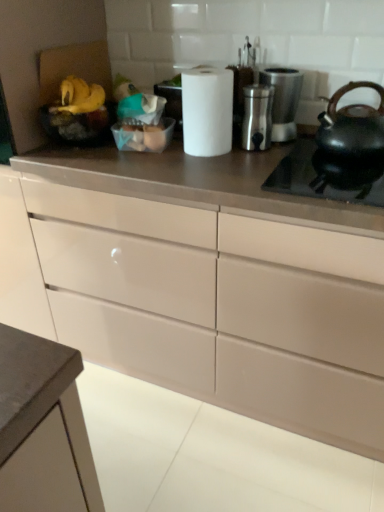
Find the location of a particular element. vacant area that lies between satin silver container at center, the 1th appliance from the left, and matte black kettle at right is located at coordinates (291, 151).